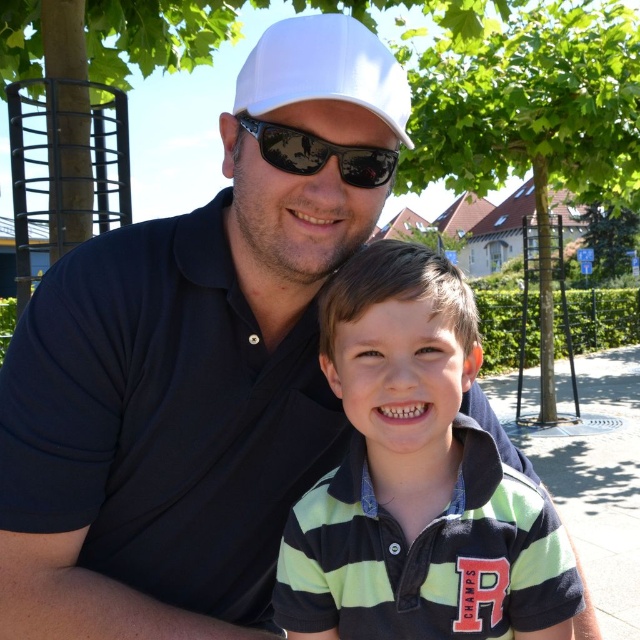
Question: Does matte black polo shirt at center have a smaller size compared to green striped polo shirt at center?

Choices:
 (A) no
 (B) yes

Answer: (A)

Question: Which object appears closest to the camera in this image?

Choices:
 (A) matte black polo shirt at center
 (B) white matte cap at upper center
 (C) black reflective sunglasses at center

Answer: (A)

Question: Which point is farther to the camera?

Choices:
 (A) black reflective sunglasses at center
 (B) matte black polo shirt at center
 (C) green striped polo shirt at center
 (D) white matte cap at upper center

Answer: (A)

Question: Among these objects, which one is farthest from the camera?

Choices:
 (A) black reflective sunglasses at center
 (B) green striped polo shirt at center
 (C) white matte cap at upper center
 (D) matte black polo shirt at center

Answer: (A)

Question: Is matte black polo shirt at center bigger than green striped polo shirt at center?

Choices:
 (A) no
 (B) yes

Answer: (B)

Question: Does matte black polo shirt at center appear on the left side of white matte cap at upper center?

Choices:
 (A) no
 (B) yes

Answer: (B)